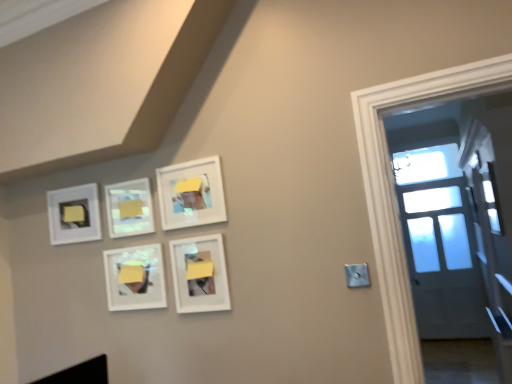
Question: Is white matte picture frame at lower center, which is the 5th picture frame from left to right, at the back of matte white picture frame at upper left, which appears as the 5th picture frame when viewed from the right?

Choices:
 (A) yes
 (B) no

Answer: (B)

Question: Considering the relative positions of matte white picture frame at upper left, which appears as the 5th picture frame when viewed from the right, and white matte picture frame at lower center, the 1th picture frame when ordered from right to left, in the image provided, is matte white picture frame at upper left, which appears as the 5th picture frame when viewed from the right, in front of white matte picture frame at lower center, the 1th picture frame when ordered from right to left,?

Choices:
 (A) no
 (B) yes

Answer: (A)

Question: Are matte white picture frame at upper left, which appears as the 5th picture frame when viewed from the right, and white matte picture frame at lower center, the 1th picture frame when ordered from right to left, beside each other?

Choices:
 (A) no
 (B) yes

Answer: (A)

Question: Is matte white picture frame at upper left, which is counted as the 1th picture frame, starting from the left, oriented towards white matte picture frame at lower center, which is the 5th picture frame from left to right?

Choices:
 (A) yes
 (B) no

Answer: (B)

Question: Can you confirm if matte white picture frame at upper left, which appears as the 5th picture frame when viewed from the right, is positioned to the left of white matte picture frame at lower center, which is the 5th picture frame from left to right?

Choices:
 (A) yes
 (B) no

Answer: (A)

Question: Is matte white picture frame at upper left, which appears as the 5th picture frame when viewed from the right, behind white matte picture frame at lower center, the 1th picture frame when ordered from right to left?

Choices:
 (A) yes
 (B) no

Answer: (A)

Question: From a real-world perspective, is white matte picture frame at lower center, the 1th picture frame when ordered from right to left, on top of matte white picture frame at upper center, the 2th picture frame when ordered from left to right?

Choices:
 (A) yes
 (B) no

Answer: (B)

Question: Can you confirm if white matte picture frame at lower center, the 1th picture frame when ordered from right to left, is taller than matte white picture frame at upper center, the 2th picture frame when ordered from left to right?

Choices:
 (A) yes
 (B) no

Answer: (A)

Question: Is white matte picture frame at lower center, which is the 5th picture frame from left to right, outside matte white picture frame at upper center, positioned as the 4th picture frame in right-to-left order?

Choices:
 (A) yes
 (B) no

Answer: (A)

Question: Does white matte picture frame at lower center, which is the 5th picture frame from left to right, have a larger size compared to matte white picture frame at upper center, positioned as the 4th picture frame in right-to-left order?

Choices:
 (A) yes
 (B) no

Answer: (A)

Question: Is white matte picture frame at lower center, which is the 5th picture frame from left to right, at the left side of matte white picture frame at upper center, the 2th picture frame when ordered from left to right?

Choices:
 (A) no
 (B) yes

Answer: (A)

Question: Is the depth of white matte picture frame at lower center, which is the 5th picture frame from left to right, less than that of matte white picture frame at upper center, the 2th picture frame when ordered from left to right?

Choices:
 (A) yes
 (B) no

Answer: (A)

Question: Is yellow matte paper at upper center, which appears as the first lift when viewed from the right, far from white matte picture frame at lower center, the 1th picture frame when ordered from right to left?

Choices:
 (A) no
 (B) yes

Answer: (A)